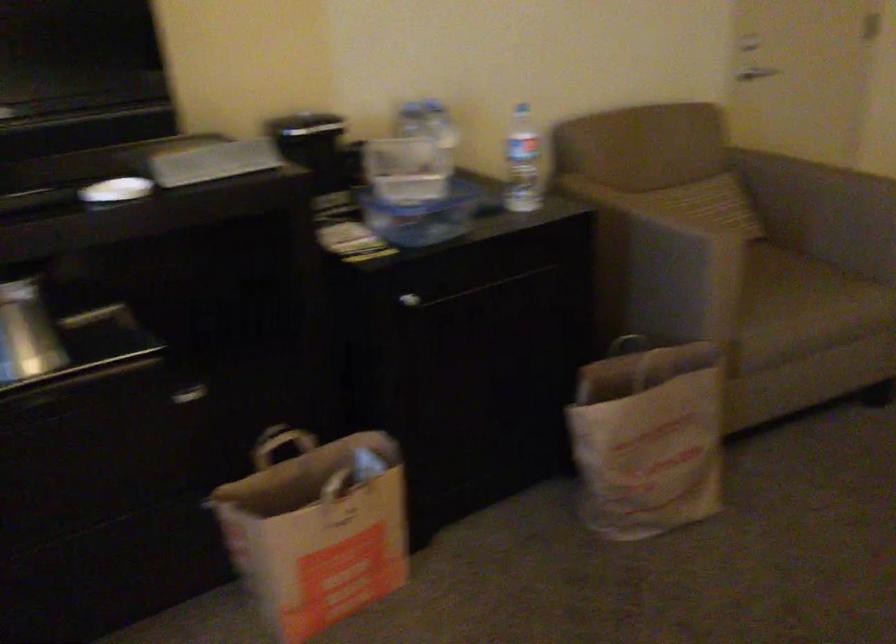
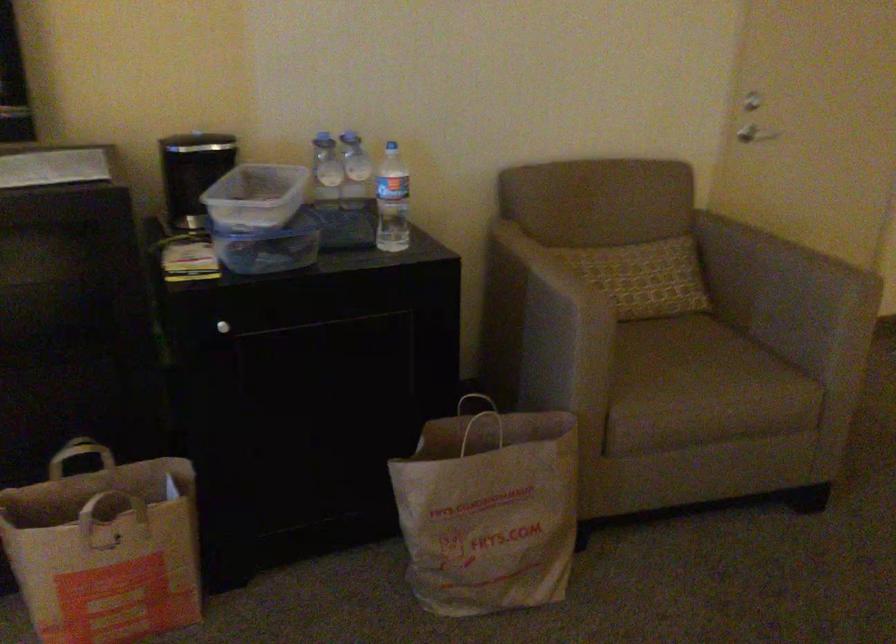
Find the pixel in the second image that matches (x=434, y=216) in the first image.

(269, 245)